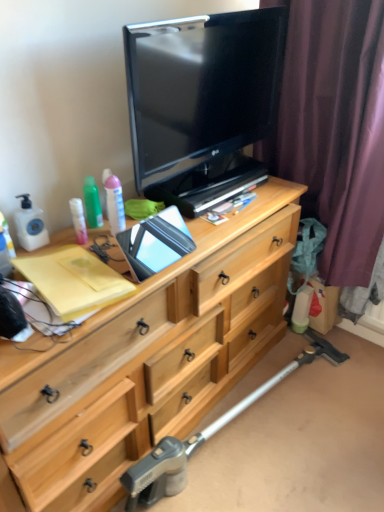
Looking at this image, in order to face light wood chest of drawers at center, should I rotate leftwards or rightwards?

A 6.059 degree turn to the left will do.

Where is `green matte spray can at upper left`? green matte spray can at upper left is located at coordinates (92, 203).

You are a GUI agent. You are given a task and a screenshot of the screen. Output one action in this format:
    pyautogui.click(x=<x>, y=<y>)
    Task: Click on the purple fabric curtain at right
    
    Given the screenshot: What is the action you would take?
    pyautogui.click(x=336, y=137)

Consider the image. Is matte black tv at upper center looking in the opposite direction of green matte spray can at upper left?

No, matte black tv at upper center is not facing away from green matte spray can at upper left.

Is matte black tv at upper center positioned beyond the bounds of green matte spray can at upper left?

Yes, matte black tv at upper center is outside of green matte spray can at upper left.

Where is `bottle below the matte black tv at upper center (from the image's perspective)`? The image size is (384, 512). bottle below the matte black tv at upper center (from the image's perspective) is located at coordinates coord(92,203).

In terms of width, does matte black tv at upper center look wider or thinner when compared to green matte spray can at upper left?

In the image, matte black tv at upper center appears to be wider than green matte spray can at upper left.

How different are the orientations of matte black tv at upper center and purple fabric curtain at right in degrees?

86.4 degrees.

Who is taller, matte black tv at upper center or purple fabric curtain at right?

With more height is purple fabric curtain at right.

Which object is positioned more to the right, matte black tv at upper center or purple fabric curtain at right?

Positioned to the right is purple fabric curtain at right.

Looking at their sizes, would you say matte black tv at upper center is wider or thinner than purple fabric curtain at right?

Clearly, matte black tv at upper center has less width compared to purple fabric curtain at right.

Considering the relative sizes of metallic silver crutch at lower center and light wood chest of drawers at center in the image provided, is metallic silver crutch at lower center bigger than light wood chest of drawers at center?

No.

Where is `the chest of drawers lying in front of the metallic silver crutch at lower center`? the chest of drawers lying in front of the metallic silver crutch at lower center is located at coordinates (147, 359).

Is metallic silver crutch at lower center facing towards light wood chest of drawers at center?

No, metallic silver crutch at lower center is not facing towards light wood chest of drawers at center.

From a real-world perspective, is metallic silver crutch at lower center physically above light wood chest of drawers at center?

Actually, metallic silver crutch at lower center is physically below light wood chest of drawers at center in the real world.

Is metallic silver crutch at lower center positioned before green matte spray can at upper left?

Yes, it is in front of green matte spray can at upper left.

From the image's perspective, which one is positioned lower, metallic silver crutch at lower center or green matte spray can at upper left?

metallic silver crutch at lower center, from the image's perspective.

Can you confirm if metallic silver crutch at lower center is bigger than green matte spray can at upper left?

Yes.

Looking at this image, in terms of size, does green matte spray can at upper left appear bigger or smaller than light wood chest of drawers at center?

Clearly, green matte spray can at upper left is smaller in size than light wood chest of drawers at center.

Which is closer, [102,223] or [127,454]?

Point [102,223] is closer to the camera than point [127,454].

Considering the relative sizes of green matte spray can at upper left and light wood chest of drawers at center in the image provided, is green matte spray can at upper left shorter than light wood chest of drawers at center?

Correct, green matte spray can at upper left is not as tall as light wood chest of drawers at center.

From the image's perspective, which is above, green matte spray can at upper left or light wood chest of drawers at center?

green matte spray can at upper left, from the image's perspective.

Is metallic silver crutch at lower center at the back of green matte spray can at upper left?

green matte spray can at upper left does not have its back to metallic silver crutch at lower center.

Find the location of a particular element. crutch lying in front of the green matte spray can at upper left is located at coordinates (205, 436).

Looking at this image, considering the sizes of objects green matte spray can at upper left and metallic silver crutch at lower center in the image provided, who is shorter, green matte spray can at upper left or metallic silver crutch at lower center?

With less height is green matte spray can at upper left.

From the image's perspective, between green matte spray can at upper left and metallic silver crutch at lower center, who is located below?

metallic silver crutch at lower center, from the image's perspective.

From the image's perspective, is purple fabric curtain at right over metallic silver crutch at lower center?

Yes, from the image's perspective, purple fabric curtain at right is over metallic silver crutch at lower center.

Is purple fabric curtain at right in contact with metallic silver crutch at lower center?

No, purple fabric curtain at right is not in contact with metallic silver crutch at lower center.

Which object is closer to the camera, purple fabric curtain at right or metallic silver crutch at lower center?

metallic silver crutch at lower center.

Identify the location of crutch in front of the purple fabric curtain at right. The height and width of the screenshot is (512, 384). (205, 436).

Identify the location of bottle that is under the matte black tv at upper center (from a real-world perspective). This screenshot has height=512, width=384. (92, 203).

Locate an element on the screen. curtain behind the matte black tv at upper center is located at coordinates (336, 137).

Considering their positions, is green matte spray can at upper left positioned closer to purple fabric curtain at right than matte black tv at upper center?

matte black tv at upper center.

Considering their positions, is matte black tv at upper center positioned further to light wood chest of drawers at center than metallic silver crutch at lower center?

matte black tv at upper center.

Which object lies nearer to the anchor point light wood chest of drawers at center, green matte spray can at upper left or purple fabric curtain at right?

Based on the image, green matte spray can at upper left appears to be nearer to light wood chest of drawers at center.

When comparing their distances from light wood chest of drawers at center, does metallic silver crutch at lower center or matte black tv at upper center seem further?

Based on the image, matte black tv at upper center appears to be further to light wood chest of drawers at center.

Which object lies further to the anchor point green matte spray can at upper left, matte black tv at upper center or light wood chest of drawers at center?

light wood chest of drawers at center.

Looking at the image, which one is located further to purple fabric curtain at right, green matte spray can at upper left or light wood chest of drawers at center?

The object further to purple fabric curtain at right is green matte spray can at upper left.

When comparing their distances from light wood chest of drawers at center, does matte black tv at upper center or green matte spray can at upper left seem further?

green matte spray can at upper left.

Based on their spatial positions, is metallic silver crutch at lower center or light wood chest of drawers at center closer to green matte spray can at upper left?

light wood chest of drawers at center is closer to green matte spray can at upper left.

The image size is (384, 512). What are the coordinates of `chest of drawers between purple fabric curtain at right and metallic silver crutch at lower center in the up-down direction` in the screenshot? It's located at (147, 359).

Image resolution: width=384 pixels, height=512 pixels. Find the location of `curtain that lies between matte black tv at upper center and light wood chest of drawers at center from top to bottom`. curtain that lies between matte black tv at upper center and light wood chest of drawers at center from top to bottom is located at coordinates (336, 137).

Where is `bottle between matte black tv at upper center and metallic silver crutch at lower center in the vertical direction`? The width and height of the screenshot is (384, 512). bottle between matte black tv at upper center and metallic silver crutch at lower center in the vertical direction is located at coordinates (92, 203).

Identify the location of bottle between matte black tv at upper center and light wood chest of drawers at center in the vertical direction. This screenshot has width=384, height=512. (92, 203).